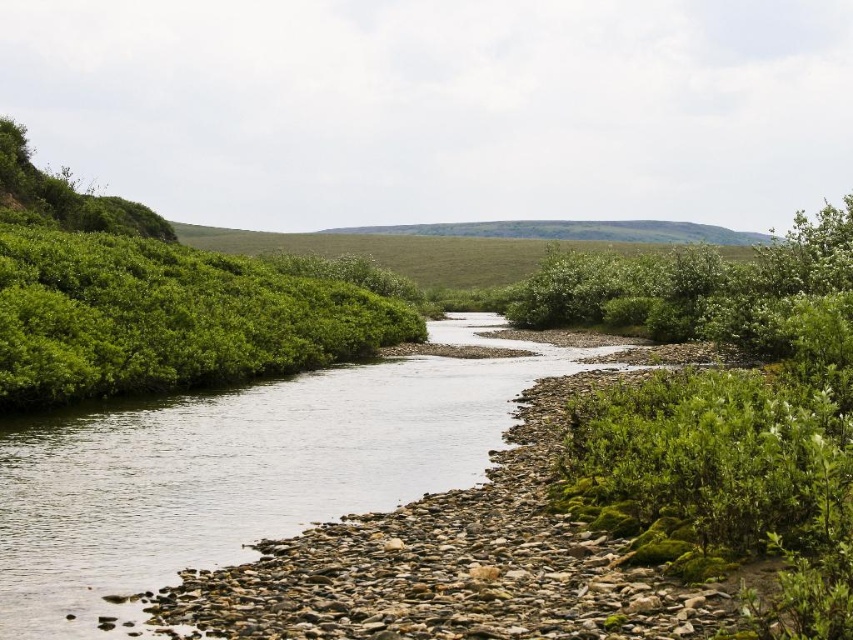
You are standing on the riverbank and want to cross to the other side. You see the clear water at center and the green leafy shrubs at left. Which one is closer to you?

The clear water at center is closer to you because it is in front of the green leafy shrubs at left.

You are planning to build a small wooden bridge over the clear water at center. The bridge must be placed between the green leafy shrubs at left and another object. Which object is the bridge placed between?

The bridge is placed between the green leafy shrubs at left and the clear water at center, as the clear water at center occupies less space than the green leafy shrubs at left, indicating it is narrower and suitable for a bridge placement.